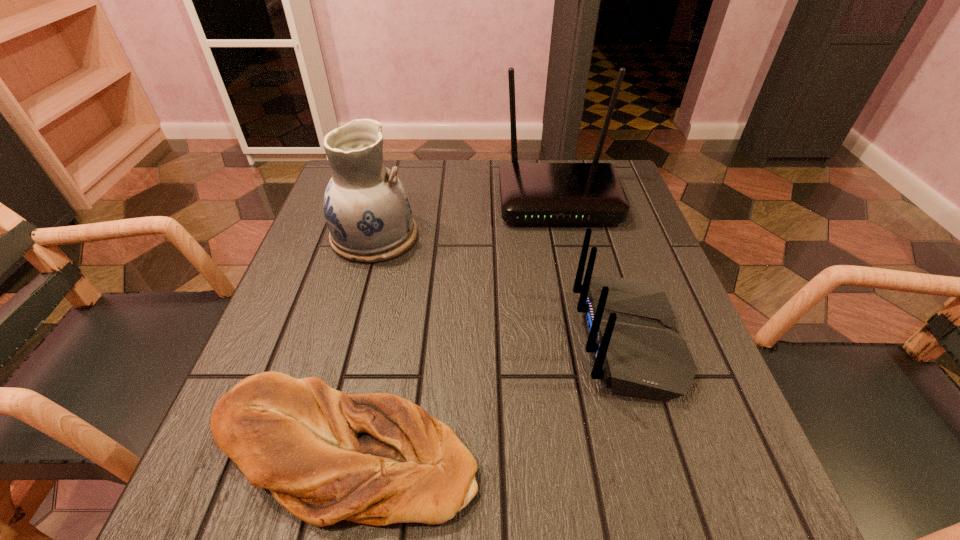
The height and width of the screenshot is (540, 960). I want to click on object that is the closest to the nearer router, so click(x=377, y=459).

Locate which object ranks third in proximity to the bread. Please provide its 2D coordinates. Your answer should be formatted as a tuple, i.e. [(x, y)], where the tuple contains the x and y coordinates of a point satisfying the conditions above.

[(530, 192)]

Identify the location of vacant area in the image that satisfies the following two spatial constraints: 1. on the back of the second shortest object; 2. on the front side of the shortest object. The image size is (960, 540). (661, 451).